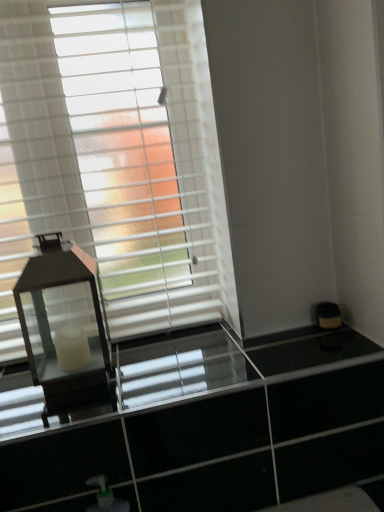
Question: From a real-world perspective, is matte black lantern at left on top of white matte window blind at upper left?

Choices:
 (A) no
 (B) yes

Answer: (A)

Question: Would you say matte black lantern at left contains white matte window blind at upper left?

Choices:
 (A) no
 (B) yes

Answer: (A)

Question: Considering the relative sizes of matte black lantern at left and white matte window blind at upper left in the image provided, is matte black lantern at left smaller than white matte window blind at upper left?

Choices:
 (A) yes
 (B) no

Answer: (A)

Question: Is matte black lantern at left looking in the opposite direction of white matte window blind at upper left?

Choices:
 (A) yes
 (B) no

Answer: (A)

Question: From a real-world perspective, is matte black lantern at left under white matte window blind at upper left?

Choices:
 (A) no
 (B) yes

Answer: (B)

Question: Considering the positions of clear glass dresser at center and matte black lantern at left in the image, is clear glass dresser at center wider or thinner than matte black lantern at left?

Choices:
 (A) thin
 (B) wide

Answer: (B)

Question: Is clear glass dresser at center in front of or behind matte black lantern at left in the image?

Choices:
 (A) front
 (B) behind

Answer: (A)

Question: Would you say clear glass dresser at center is inside or outside matte black lantern at left?

Choices:
 (A) inside
 (B) outside

Answer: (B)

Question: Based on their sizes in the image, would you say clear glass dresser at center is bigger or smaller than matte black lantern at left?

Choices:
 (A) big
 (B) small

Answer: (B)

Question: From the image's perspective, relative to matte black lantern at left, is white matte window blind at upper left above or below?

Choices:
 (A) above
 (B) below

Answer: (A)

Question: Which is correct: white matte window blind at upper left is inside matte black lantern at left, or outside of it?

Choices:
 (A) outside
 (B) inside

Answer: (A)

Question: Considering the positions of white matte window blind at upper left and matte black lantern at left in the image, is white matte window blind at upper left taller or shorter than matte black lantern at left?

Choices:
 (A) short
 (B) tall

Answer: (B)

Question: Looking at their shapes, would you say white matte window blind at upper left is wider or thinner than matte black lantern at left?

Choices:
 (A) wide
 (B) thin

Answer: (B)

Question: Is point (77, 49) positioned closer to the camera than point (342, 366)?

Choices:
 (A) farther
 (B) closer

Answer: (A)

Question: From a real-world perspective, is white matte window blind at upper left above or below clear glass dresser at center?

Choices:
 (A) below
 (B) above

Answer: (B)